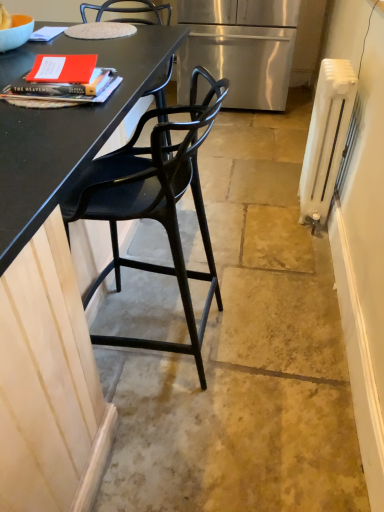
Find the location of a particular element. This screenshot has height=512, width=384. unoccupied region to the right of black matte chair at left is located at coordinates (269, 343).